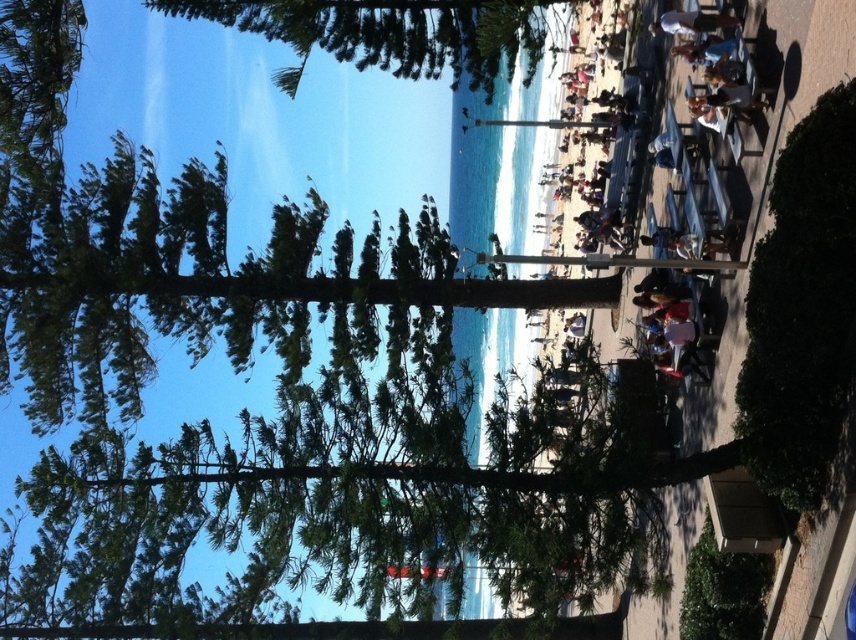
Is green leafy bush at lower right above white fabric shirt at upper right?

No.

Is green leafy bush at lower right bigger than white fabric shirt at upper right?

Yes.

Is point (816, 225) farther from viewer compared to point (655, 28)?

No, it is not.

The image size is (856, 640). Find the location of `green leafy bush at lower right`. green leafy bush at lower right is located at coordinates (801, 308).

Which is more to the right, green leafy tree at upper center or white fabric shirt at upper right?

white fabric shirt at upper right

Between green leafy tree at upper center and white fabric shirt at upper right, which one has more height?

green leafy tree at upper center

Between point (343, 1) and point (691, 12), which one is positioned behind?

The point (343, 1) is more distant.

Find the location of a particular element. The height and width of the screenshot is (640, 856). green leafy tree at upper center is located at coordinates pyautogui.click(x=389, y=33).

Is green leafy bush at lower right taller than green leafy tree at upper center?

Correct, green leafy bush at lower right is much taller as green leafy tree at upper center.

Does green leafy bush at lower right have a lesser height compared to green leafy tree at upper center?

No, green leafy bush at lower right is not shorter than green leafy tree at upper center.

Which is in front, point (771, 442) or point (366, 44)?

Positioned in front is point (771, 442).

The height and width of the screenshot is (640, 856). I want to click on green leafy bush at lower right, so click(x=801, y=308).